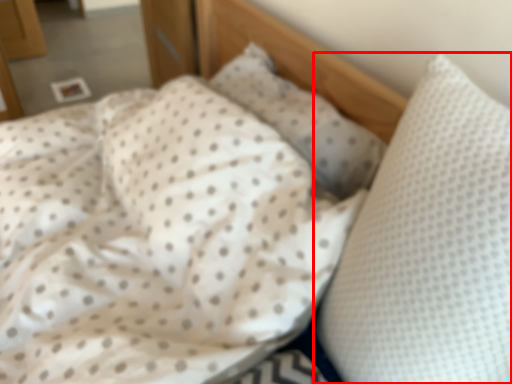
Question: From the image's perspective, considering the relative positions of pillow (annotated by the red box) and pillow in the image provided, where is pillow (annotated by the red box) located with respect to the staircase?

Choices:
 (A) below
 (B) above

Answer: (A)